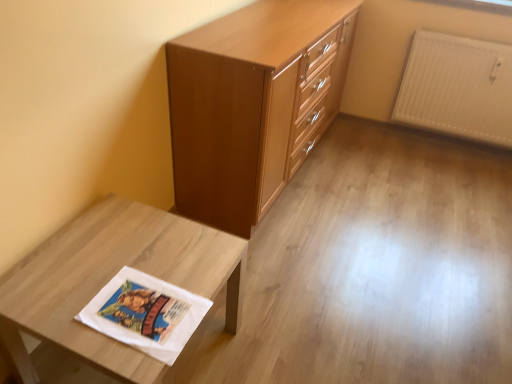
Question: Considering the relative positions of white matte fabric at lower left and white textured radiator at upper right in the image provided, is white matte fabric at lower left to the left of white textured radiator at upper right from the viewer's perspective?

Choices:
 (A) no
 (B) yes

Answer: (B)

Question: Can you confirm if white matte fabric at lower left is taller than white textured radiator at upper right?

Choices:
 (A) no
 (B) yes

Answer: (A)

Question: Does white matte fabric at lower left appear on the right side of white textured radiator at upper right?

Choices:
 (A) no
 (B) yes

Answer: (A)

Question: From the image's perspective, is white matte fabric at lower left above white textured radiator at upper right?

Choices:
 (A) yes
 (B) no

Answer: (B)

Question: Is white textured radiator at upper right inside white matte fabric at lower left?

Choices:
 (A) no
 (B) yes

Answer: (A)

Question: Would you say white textured radiator at upper right is inside or outside white matte fabric at lower left?

Choices:
 (A) outside
 (B) inside

Answer: (A)

Question: In the image, is white textured radiator at upper right positioned in front of or behind white matte fabric at lower left?

Choices:
 (A) behind
 (B) front

Answer: (A)

Question: Considering the positions of white textured radiator at upper right and white matte fabric at lower left in the image, is white textured radiator at upper right wider or thinner than white matte fabric at lower left?

Choices:
 (A) wide
 (B) thin

Answer: (B)

Question: From their relative heights in the image, would you say white textured radiator at upper right is taller or shorter than white matte fabric at lower left?

Choices:
 (A) short
 (B) tall

Answer: (B)

Question: From the image's perspective, relative to matte wood chest of drawers at center, is white matte fabric at lower left above or below?

Choices:
 (A) above
 (B) below

Answer: (B)

Question: From a real-world perspective, is white matte fabric at lower left positioned above or below matte wood chest of drawers at center?

Choices:
 (A) below
 (B) above

Answer: (A)

Question: In terms of size, does white matte fabric at lower left appear bigger or smaller than matte wood chest of drawers at center?

Choices:
 (A) big
 (B) small

Answer: (B)

Question: Is white matte fabric at lower left wider or thinner than matte wood chest of drawers at center?

Choices:
 (A) thin
 (B) wide

Answer: (B)

Question: Is matte wood chest of drawers at center in front of or behind white matte fabric at lower left in the image?

Choices:
 (A) front
 (B) behind

Answer: (B)

Question: In terms of width, does matte wood chest of drawers at center look wider or thinner when compared to white matte fabric at lower left?

Choices:
 (A) thin
 (B) wide

Answer: (A)